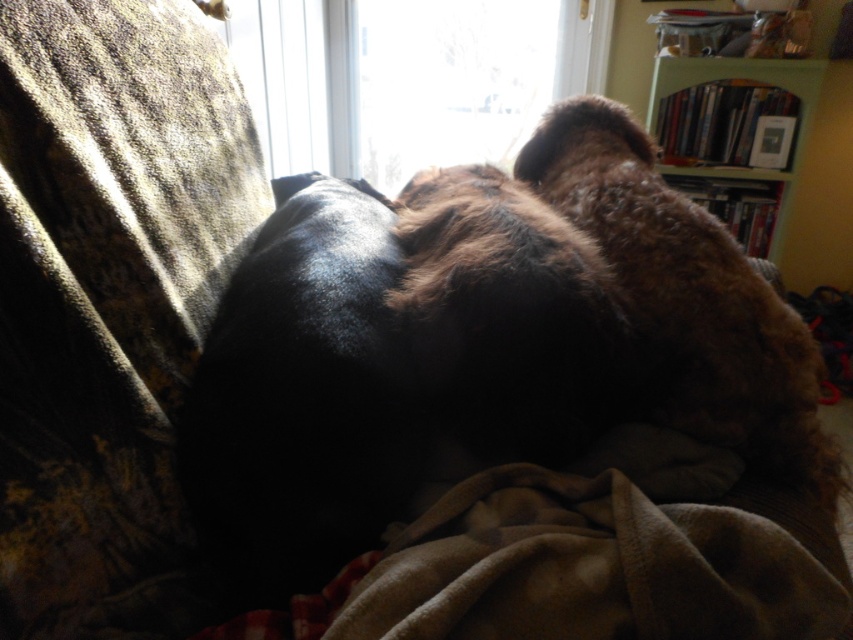
Does transparent glass window at upper center have a smaller size compared to green wood bookshelf at upper right?

No, transparent glass window at upper center is not smaller than green wood bookshelf at upper right.

Is transparent glass window at upper center positioned behind green wood bookshelf at upper right?

No.

Find the location of `transparent glass window at upper center`. transparent glass window at upper center is located at coordinates (409, 77).

Between fuzzy brown dog at center and green wood bookshelf at upper right, which one is positioned lower?

Positioned lower is fuzzy brown dog at center.

Can you confirm if fuzzy brown dog at center is positioned to the right of green wood bookshelf at upper right?

In fact, fuzzy brown dog at center is to the left of green wood bookshelf at upper right.

What do you see at coordinates (688, 296) in the screenshot? The height and width of the screenshot is (640, 853). I see `fuzzy brown dog at center` at bounding box center [688, 296].

At what (x,y) coordinates should I click in order to perform the action: click on fuzzy brown dog at center. Please return your answer as a coordinate pair (x, y). Looking at the image, I should click on point(688,296).

Describe the element at coordinates (509, 316) in the screenshot. I see `brown fuzzy dog at center` at that location.

Which is behind, point (526, 360) or point (312, 44)?

The point (312, 44) is more distant.

Identify the location of brown fuzzy dog at center. The height and width of the screenshot is (640, 853). (509, 316).